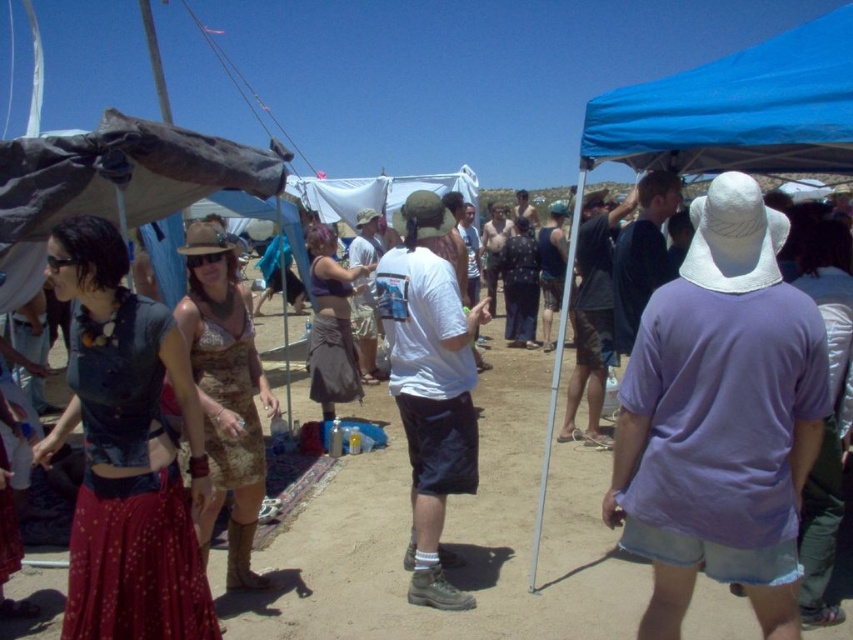
Question: Which object is closer to the camera taking this photo?

Choices:
 (A) white cotton shirt at center
 (B) matte black top at center
 (C) camouflage dress at center
 (D) blue fabric canopy at upper right

Answer: (B)

Question: Is matte black top at center further to the viewer compared to white cotton shirt at center?

Choices:
 (A) yes
 (B) no

Answer: (B)

Question: Which object is closer to the camera taking this photo?

Choices:
 (A) matte black top at center
 (B) white cotton shirt at center
 (C) purple cotton shirt at center
 (D) camouflage dress at center

Answer: (C)

Question: Does purple cotton shirt at center have a lesser width compared to matte black top at center?

Choices:
 (A) no
 (B) yes

Answer: (B)

Question: Does matte black top at center appear on the right side of camouflage dress at center?

Choices:
 (A) no
 (B) yes

Answer: (A)

Question: Which of the following is the closest to the observer?

Choices:
 (A) blue fabric canopy at upper right
 (B) camouflage dress at center
 (C) white cotton shirt at center
 (D) matte black top at center

Answer: (D)